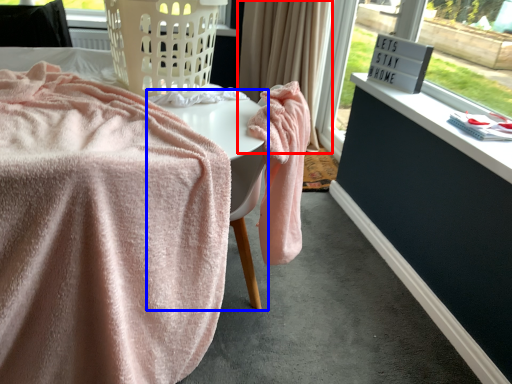
Question: Which object appears closest to the camera in this image, curtain (highlighted by a red box) or table (highlighted by a blue box)?

Choices:
 (A) curtain
 (B) table

Answer: (B)